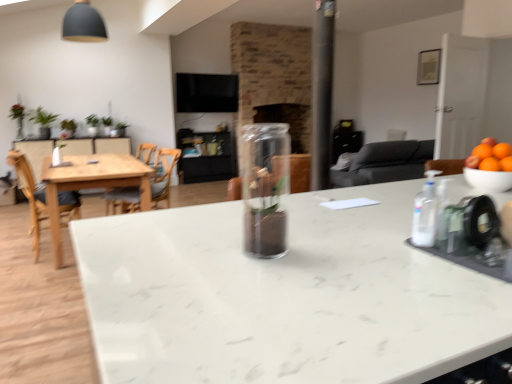
Question: Is orange matte bowl at right in front of white marble countertop at center?

Choices:
 (A) yes
 (B) no

Answer: (B)

Question: From the image's perspective, is orange matte bowl at right located above white marble countertop at center?

Choices:
 (A) yes
 (B) no

Answer: (A)

Question: Can you confirm if orange matte bowl at right is bigger than white marble countertop at center?

Choices:
 (A) no
 (B) yes

Answer: (A)

Question: Can you confirm if orange matte bowl at right is taller than white marble countertop at center?

Choices:
 (A) no
 (B) yes

Answer: (A)

Question: From the image's perspective, is orange matte bowl at right under white marble countertop at center?

Choices:
 (A) yes
 (B) no

Answer: (B)

Question: Considering the positions of transparent plastic bottle at right and white marble countertop at center in the image, is transparent plastic bottle at right taller or shorter than white marble countertop at center?

Choices:
 (A) short
 (B) tall

Answer: (A)

Question: Considering the positions of transparent plastic bottle at right and white marble countertop at center in the image, is transparent plastic bottle at right wider or thinner than white marble countertop at center?

Choices:
 (A) wide
 (B) thin

Answer: (B)

Question: Visually, is transparent plastic bottle at right positioned to the left or to the right of white marble countertop at center?

Choices:
 (A) left
 (B) right

Answer: (A)

Question: From the image's perspective, is transparent plastic bottle at right located above or below white marble countertop at center?

Choices:
 (A) below
 (B) above

Answer: (B)

Question: In the image, is wooden chair at left, the first chair viewed from the left, positioned in front of or behind transparent plastic bottle at right?

Choices:
 (A) behind
 (B) front

Answer: (A)

Question: Considering the positions of wooden chair at left, which ranks as the 2th chair in right-to-left order, and transparent plastic bottle at right in the image, is wooden chair at left, which ranks as the 2th chair in right-to-left order, taller or shorter than transparent plastic bottle at right?

Choices:
 (A) short
 (B) tall

Answer: (B)

Question: Considering the positions of point (61, 206) and point (432, 221), is point (61, 206) closer or farther from the camera than point (432, 221)?

Choices:
 (A) closer
 (B) farther

Answer: (B)

Question: From a real-world perspective, is wooden chair at left, the first chair viewed from the left, above or below transparent plastic bottle at right?

Choices:
 (A) above
 (B) below

Answer: (B)

Question: From their relative heights in the image, would you say light wood table at left is taller or shorter than wooden chair at left, positioned as the 2th chair in left-to-right order?

Choices:
 (A) tall
 (B) short

Answer: (A)

Question: Is point (165, 200) positioned closer to the camera than point (129, 198)?

Choices:
 (A) closer
 (B) farther

Answer: (A)